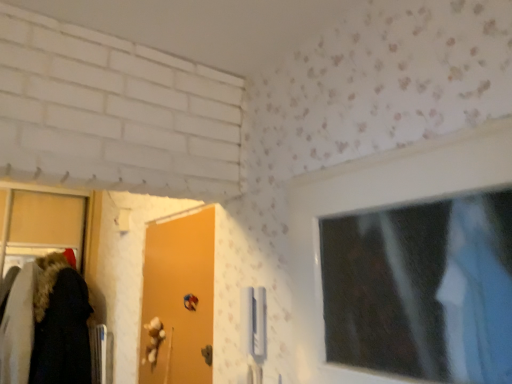
This screenshot has height=384, width=512. Describe the element at coordinates (207, 354) in the screenshot. I see `metallic blue door handle at lower center` at that location.

Identify the location of metallic blue door handle at lower center. [x=207, y=354].

What do you see at coordinates (179, 297) in the screenshot?
I see `orange matte door at center` at bounding box center [179, 297].

At what (x,y) coordinates should I click in order to perform the action: click on orange matte door at center. Please return your answer as a coordinate pair (x, y). The width and height of the screenshot is (512, 384). Looking at the image, I should click on (179, 297).

The image size is (512, 384). In order to click on metallic blue door handle at lower center in this screenshot , I will do `click(207, 354)`.

Considering the relative positions of metallic blue door handle at lower center and orange matte door at center in the image provided, is metallic blue door handle at lower center to the left of orange matte door at center from the viewer's perspective?

No, metallic blue door handle at lower center is not to the left of orange matte door at center.

Which is behind, metallic blue door handle at lower center or orange matte door at center?

metallic blue door handle at lower center is more distant.

Which is less distant, (211, 359) or (196, 340)?

Point (211, 359) is closer to the camera than point (196, 340).

From the image's perspective, does metallic blue door handle at lower center appear higher than orange matte door at center?

No, from the image's perspective, metallic blue door handle at lower center is not over orange matte door at center.

From a real-world perspective, is metallic blue door handle at lower center positioned above or below orange matte door at center?

metallic blue door handle at lower center is situated lower than orange matte door at center in the real world.

Between metallic blue door handle at lower center and orange matte door at center, which one has larger width?

Wider between the two is orange matte door at center.

Which of these two, metallic blue door handle at lower center or orange matte door at center, stands shorter?

metallic blue door handle at lower center.

In terms of size, does metallic blue door handle at lower center appear bigger or smaller than orange matte door at center?

Clearly, metallic blue door handle at lower center is smaller in size than orange matte door at center.

Is orange matte door at center a part of metallic blue door handle at lower center?

Definitely not — orange matte door at center is not inside metallic blue door handle at lower center.

Is there a large distance between metallic blue door handle at lower center and orange matte door at center?

No, there isn't a large distance between metallic blue door handle at lower center and orange matte door at center.

Could you tell me if metallic blue door handle at lower center is facing orange matte door at center?

Yes, metallic blue door handle at lower center faces towards orange matte door at center.

What's the angular difference between metallic blue door handle at lower center and orange matte door at center's facing directions?

0.199 degrees.

Find the location of a particular element. The width and height of the screenshot is (512, 384). door in front of the metallic blue door handle at lower center is located at coordinates (179, 297).

Which is more to the right, orange matte door at center or metallic blue door handle at lower center?

Positioned to the right is metallic blue door handle at lower center.

Which object is further away from the camera, orange matte door at center or metallic blue door handle at lower center?

metallic blue door handle at lower center is further away from the camera.

Which is nearer, (159, 248) or (208, 346)?

Point (159, 248) is farther from the camera than point (208, 346).

From the image's perspective, which object appears higher, orange matte door at center or metallic blue door handle at lower center?

From the image's view, orange matte door at center is above.

Consider the image. From a real-world perspective, who is located higher, orange matte door at center or metallic blue door handle at lower center?

orange matte door at center is physically above.

Which of these two, orange matte door at center or metallic blue door handle at lower center, is wider?

Wider between the two is orange matte door at center.

Is orange matte door at center taller than metallic blue door handle at lower center?

Yes.

Based on their sizes in the image, would you say orange matte door at center is bigger or smaller than metallic blue door handle at lower center?

In the image, orange matte door at center appears to be larger than metallic blue door handle at lower center.

Is orange matte door at center completely or partially outside of metallic blue door handle at lower center?

Yes, orange matte door at center is located beyond the bounds of metallic blue door handle at lower center.

Is the surface of orange matte door at center in direct contact with metallic blue door handle at lower center?

There is a gap between orange matte door at center and metallic blue door handle at lower center.

Consider the image. Is orange matte door at center positioned with its back to metallic blue door handle at lower center?

Yes, metallic blue door handle at lower center is at the back of orange matte door at center.

How much distance is there between orange matte door at center and metallic blue door handle at lower center?

orange matte door at center is 14.58 inches from metallic blue door handle at lower center.

You are a GUI agent. You are given a task and a screenshot of the screen. Output one action in this format:
    pyautogui.click(x=<x>, y=<y>)
    Task: Click on the door handle below the orange matte door at center (from the image's perspective)
    
    Given the screenshot: What is the action you would take?
    pyautogui.click(x=207, y=354)

The width and height of the screenshot is (512, 384). Find the location of `door handle located on the right of orange matte door at center`. door handle located on the right of orange matte door at center is located at coordinates (207, 354).

In the image, there is a metallic blue door handle at lower center. Where is `door above it (from the image's perspective)`? door above it (from the image's perspective) is located at coordinates (179, 297).